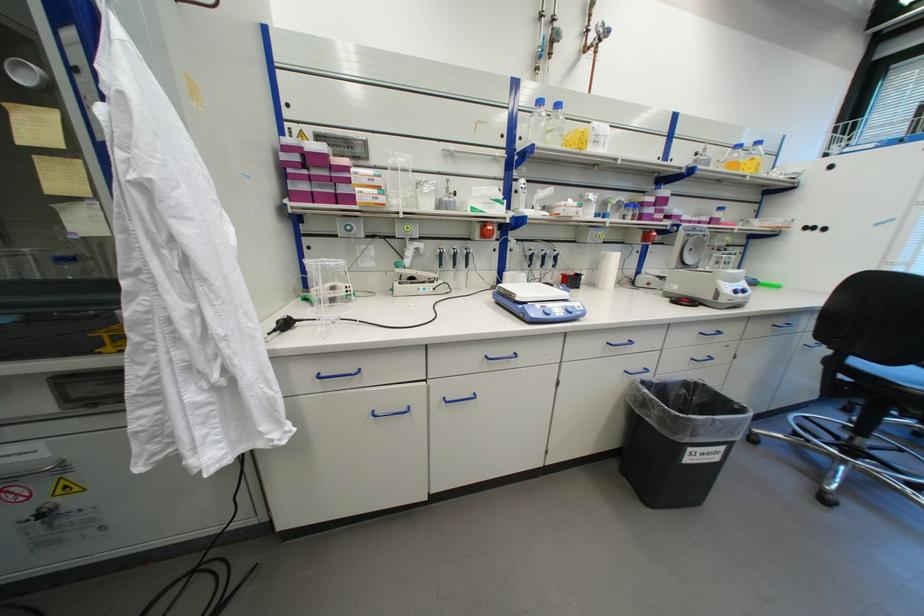
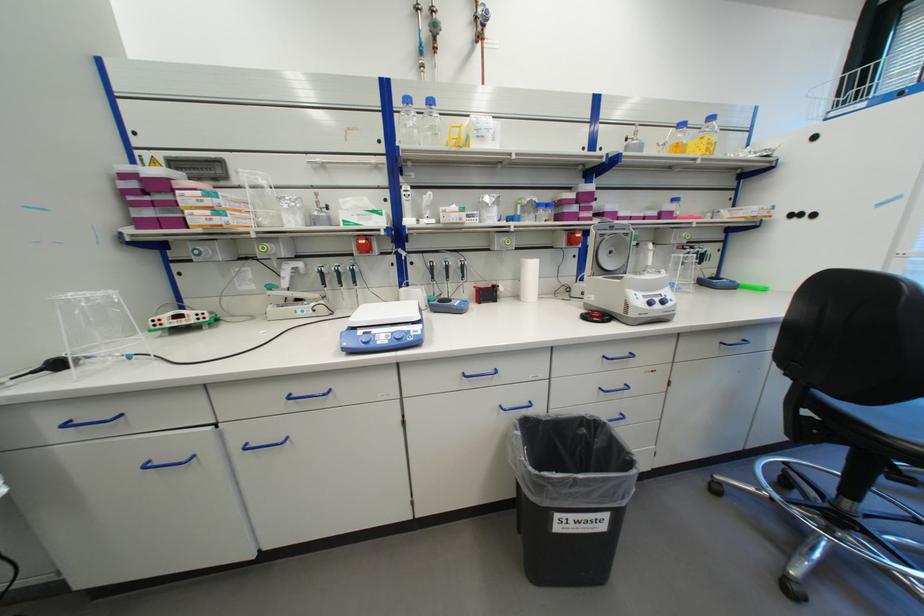
Question: The images are taken continuously from a first-person perspective. In which direction is your viewpoint rotating?

Choices:
 (A) Left
 (B) Right
 (C) Up
 (D) Down

Answer: (A)